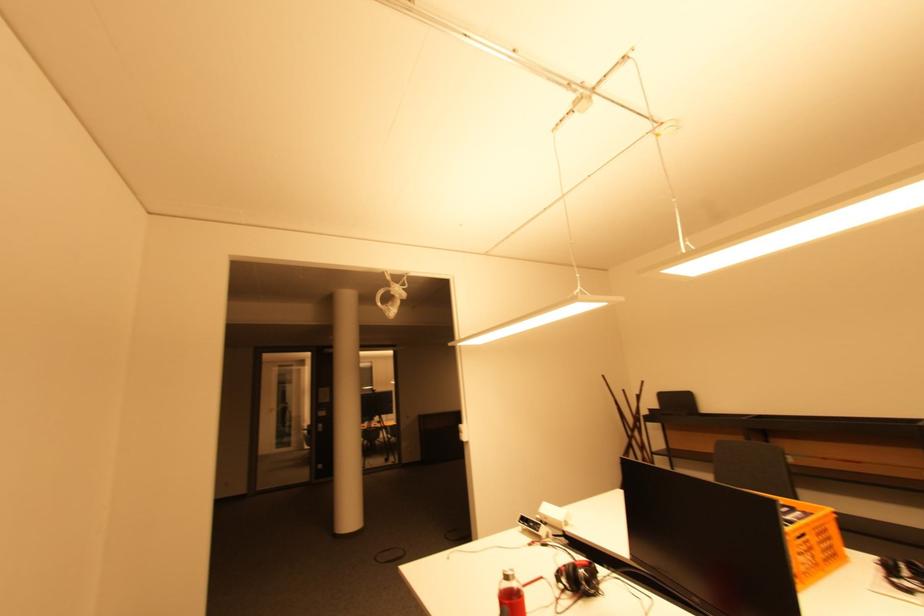
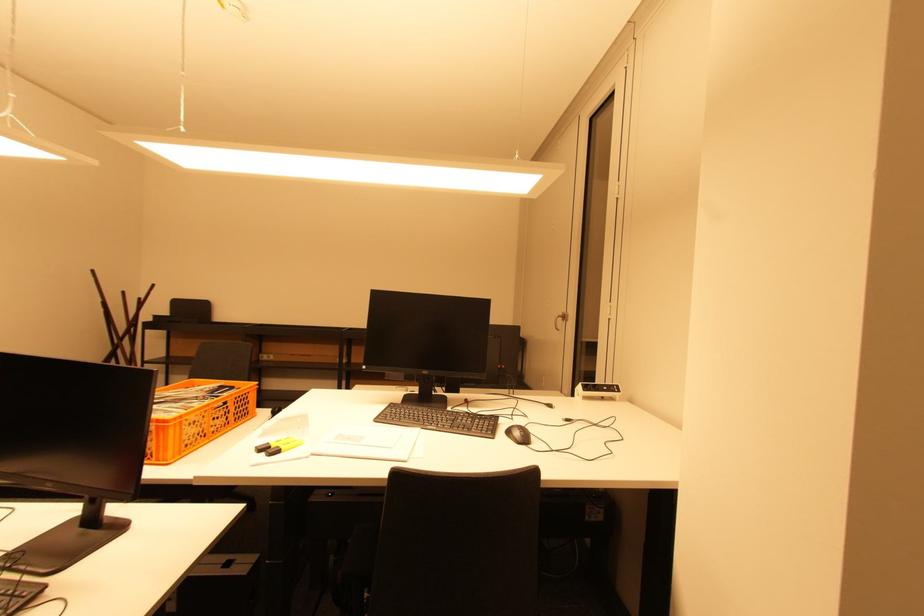
Question: Based on the continuous images, in which direction is the camera rotating? Reply with the corresponding letter.

Choices:
 (A) Left
 (B) Right
 (C) Up
 (D) Down

Answer: (B)